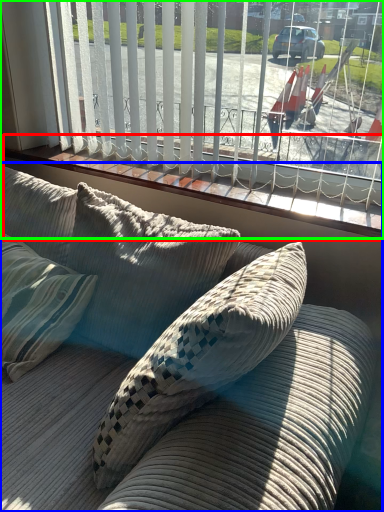
Question: Considering the real-world distances, which object is closest to window sill (highlighted by a red box)? studio couch (highlighted by a blue box) or window (highlighted by a green box).

Choices:
 (A) studio couch
 (B) window

Answer: (B)